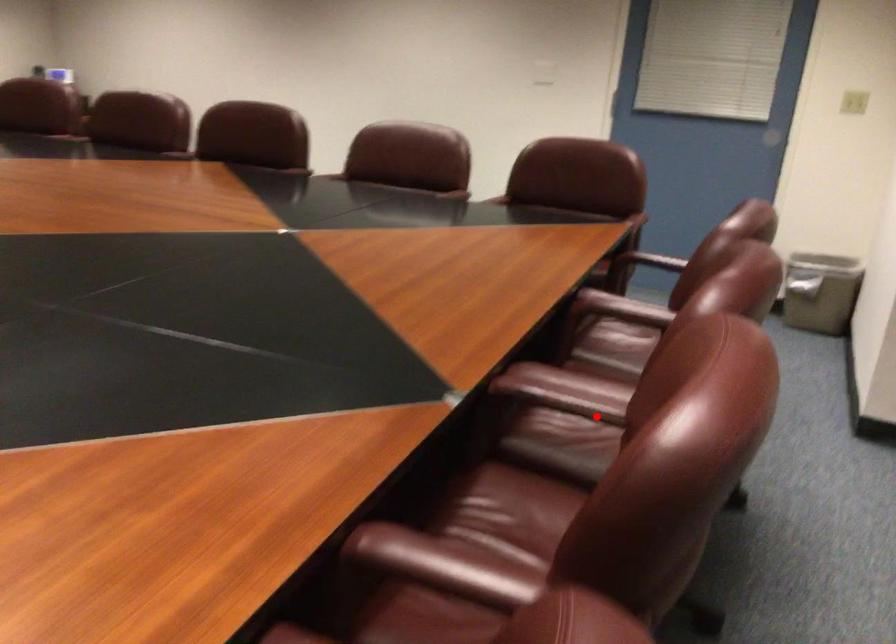
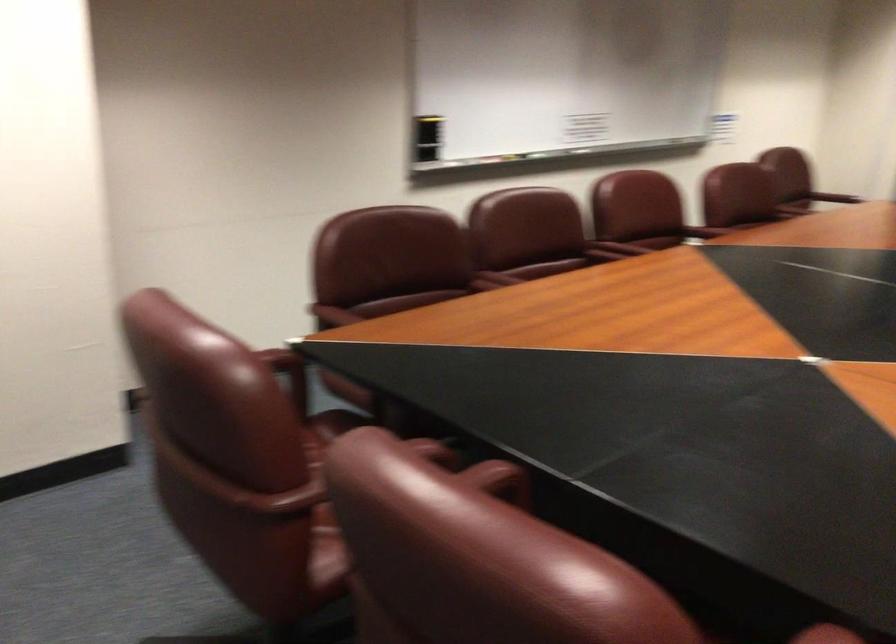
In the second image, find the point that corresponds to the highlighted location in the first image.

(618, 247)